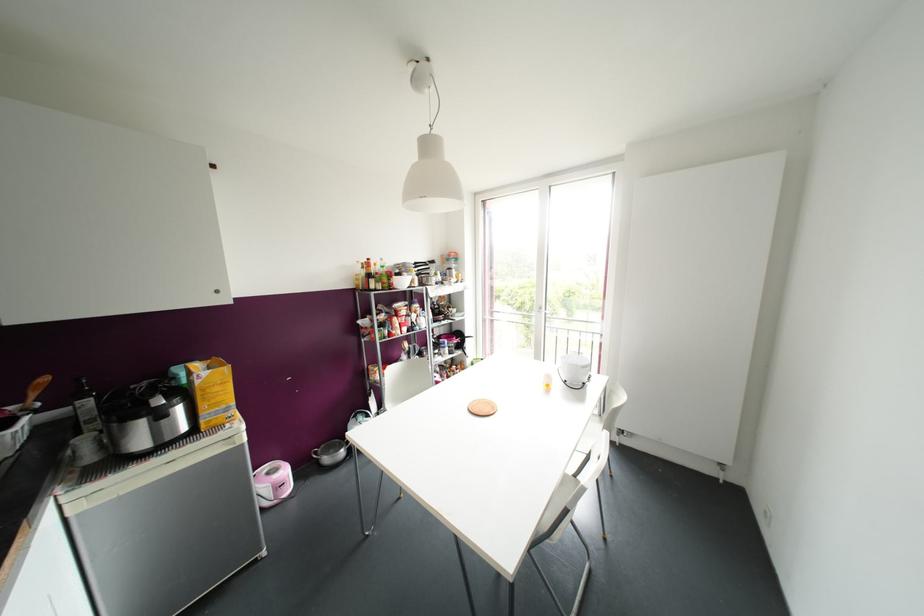
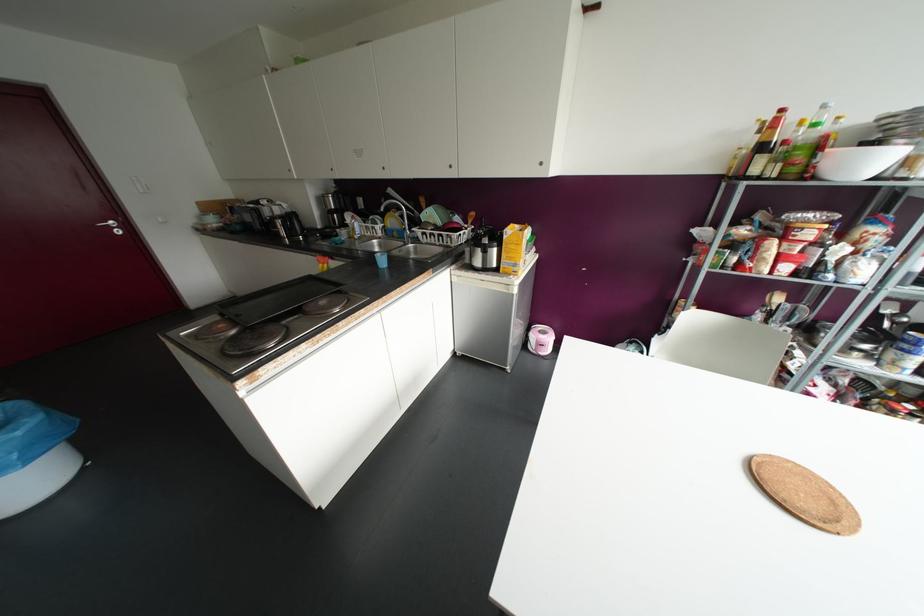
The point at (368, 259) is marked in the first image. Where is the corresponding point in the second image?

(781, 110)